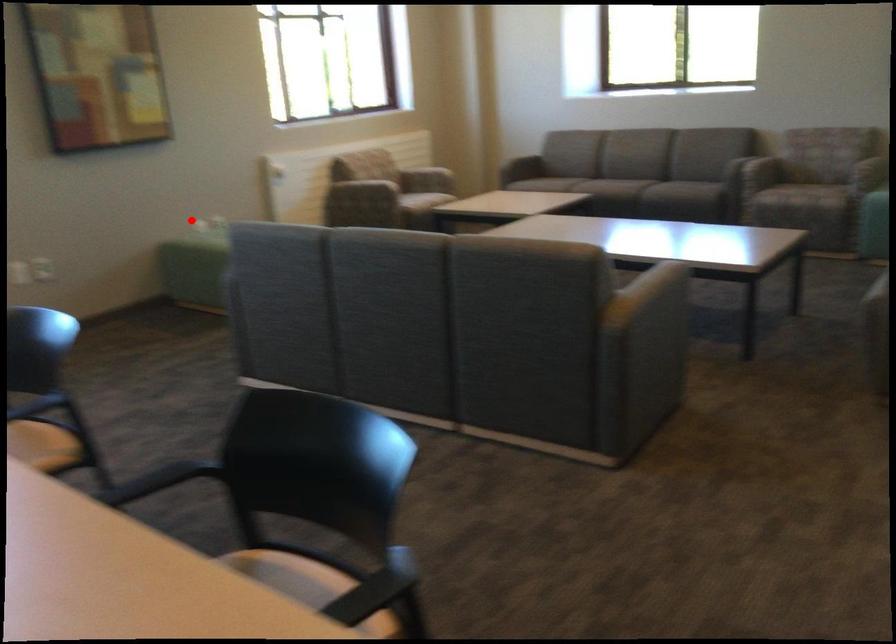
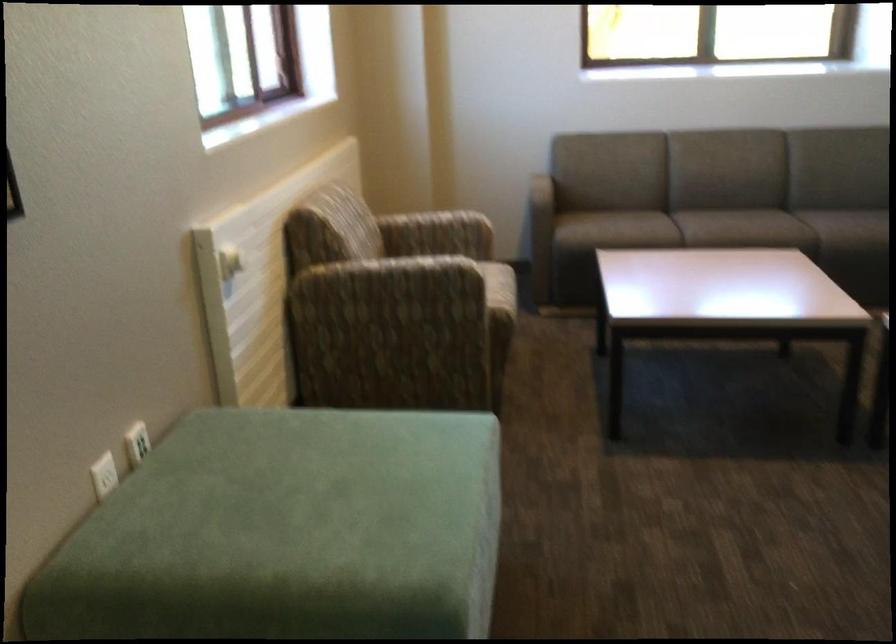
Where in the second image is the point corresponding to the highlighted location from the first image?

(104, 475)